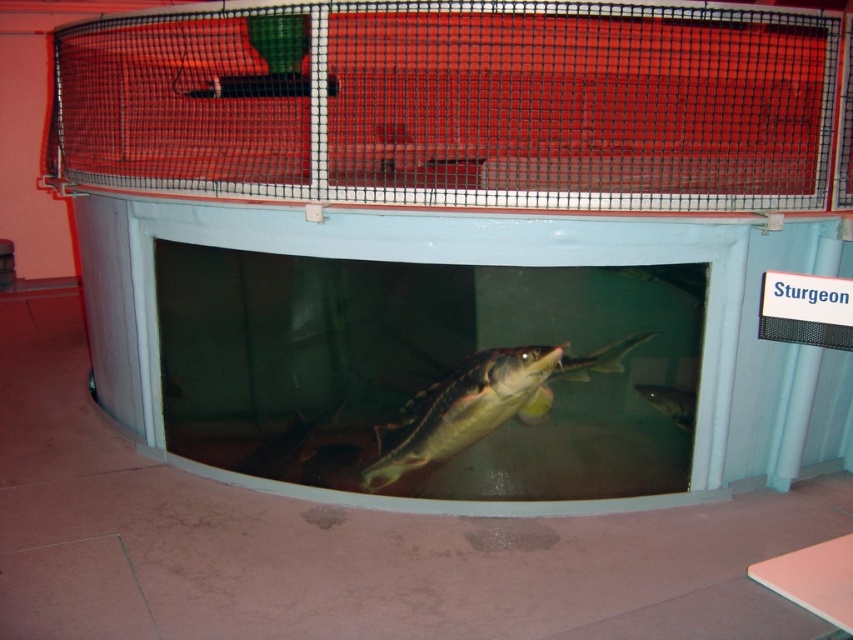
Question: Which of the following is the closest to the observer?

Choices:
 (A) (448, 392)
 (B) (569, 358)
 (C) (677, 388)
 (D) (149, 160)

Answer: (B)

Question: Can you confirm if shiny silver sturgeon at center is bigger than shiny silver fish at lower center?

Choices:
 (A) no
 (B) yes

Answer: (B)

Question: Does transparent plastic cage at upper center appear over shiny silver fish at center?

Choices:
 (A) yes
 (B) no

Answer: (A)

Question: Among these objects, which one is nearest to the camera?

Choices:
 (A) shiny silver sturgeon at center
 (B) shiny silver fish at center
 (C) transparent plastic cage at upper center

Answer: (C)

Question: Can you confirm if transparent plastic cage at upper center is positioned above shiny silver sturgeon at center?

Choices:
 (A) yes
 (B) no

Answer: (A)

Question: Which point is farther to the camera?

Choices:
 (A) shiny silver sturgeon at center
 (B) shiny silver fish at lower center

Answer: (B)